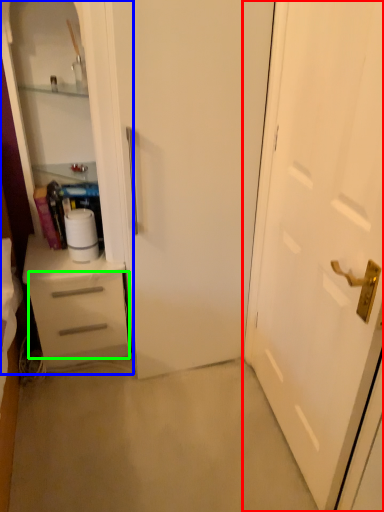
Question: Which object is the farthest from door (highlighted by a red box)? Choose among these: dresser (highlighted by a blue box) or drawer (highlighted by a green box).

Choices:
 (A) dresser
 (B) drawer

Answer: (B)